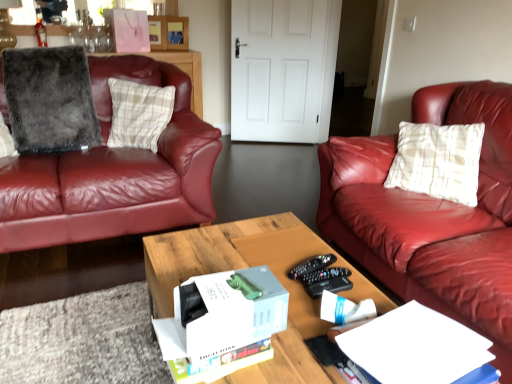
Question: From a real-world perspective, is white cardboard box at center physically above gray fluffy pillow at left, which is the first pillow from left to right?

Choices:
 (A) no
 (B) yes

Answer: (A)

Question: Is white cardboard box at center outside of gray fluffy pillow at left, which is the first pillow from left to right?

Choices:
 (A) no
 (B) yes

Answer: (B)

Question: Considering the relative sizes of white cardboard box at center and gray fluffy pillow at left, the 2th pillow positioned from the right, in the image provided, is white cardboard box at center thinner than gray fluffy pillow at left, the 2th pillow positioned from the right,?

Choices:
 (A) yes
 (B) no

Answer: (A)

Question: Is white cardboard box at center facing away from gray fluffy pillow at left, which is the first pillow from left to right?

Choices:
 (A) no
 (B) yes

Answer: (A)

Question: Is gray fluffy pillow at left, which is the first pillow from left to right, located within white cardboard box at center?

Choices:
 (A) no
 (B) yes

Answer: (A)

Question: Does white cardboard box at center have a greater width compared to gray fluffy pillow at left, the 2th pillow positioned from the right?

Choices:
 (A) no
 (B) yes

Answer: (A)

Question: Is plaid fabric pillow at left, the 2th pillow from the left, at the back of black plastic remote control at center?

Choices:
 (A) yes
 (B) no

Answer: (B)

Question: From the image's perspective, would you say black plastic remote control at center is shown under plaid fabric pillow at left, the first pillow viewed from the right?

Choices:
 (A) no
 (B) yes

Answer: (B)

Question: Is black plastic remote control at center at the right side of plaid fabric pillow at left, the first pillow viewed from the right?

Choices:
 (A) yes
 (B) no

Answer: (A)

Question: Is black plastic remote control at center oriented towards plaid fabric pillow at left, the first pillow viewed from the right?

Choices:
 (A) yes
 (B) no

Answer: (B)

Question: Is black plastic remote control at center taller than plaid fabric pillow at left, the first pillow viewed from the right?

Choices:
 (A) no
 (B) yes

Answer: (A)

Question: Is black plastic remote control at center next to plaid fabric pillow at left, the 2th pillow from the left?

Choices:
 (A) no
 (B) yes

Answer: (A)

Question: Is black plastic remote control at center positioned beyond the bounds of white cardboard box at center?

Choices:
 (A) no
 (B) yes

Answer: (B)